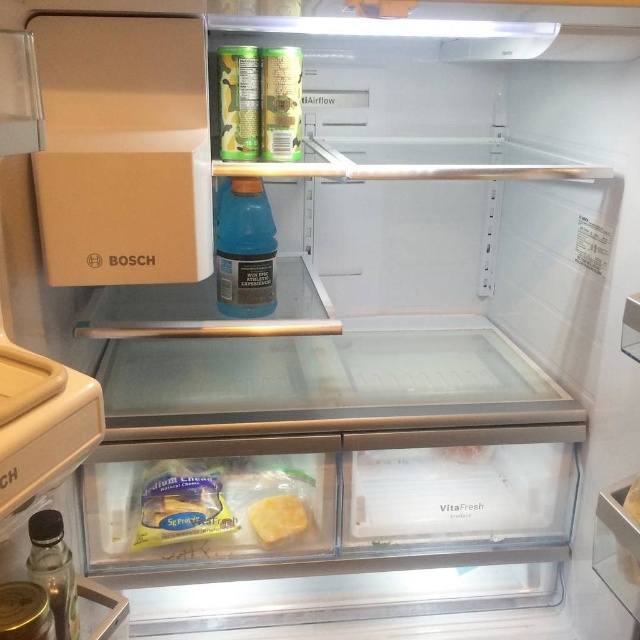
You are organizing the fridge and need to place a new item between the blue translucent bottle at center and the translucent glass bottle at lower left. Which bottle should you place the new item next to if you want it to be closer to the larger one?

The blue translucent bottle at center is larger than the translucent glass bottle at lower left, so place the new item next to the blue translucent bottle at center to be closer to the larger one.

You are organizing the fridge and want to place a new bottle of juice between the blue translucent bottle at center and the translucent glass bottle at lower left. Based on their widths, can you determine if there is enough space between them to fit the juice bottle?

The blue translucent bottle at center might be wider than the translucent glass bottle at lower left, so there may not be enough space between them to fit the juice bottle. Check the exact dimensions to be sure.

You are organizing the contents of a Bosch refrigerator and need to stack items based on their height. You have a yellow plastic cheese at lower center and a translucent glass bottle at lower left. Which item should you place on the bottom shelf to ensure stability?

The yellow plastic cheese at lower center has a lesser height compared to the translucent glass bottle at lower left. Therefore, you should place the translucent glass bottle at lower left on the bottom shelf for stability, as taller items are typically placed lower to prevent tipping.